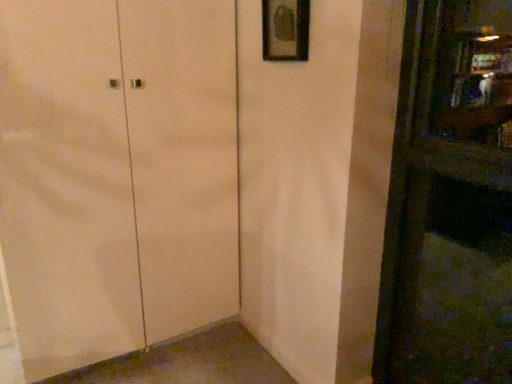
This screenshot has width=512, height=384. What do you see at coordinates (116, 173) in the screenshot? I see `matte white cabinet at center` at bounding box center [116, 173].

This screenshot has height=384, width=512. What are the coordinates of `matte white cabinet at center` in the screenshot? It's located at (116, 173).

The width and height of the screenshot is (512, 384). What are the coordinates of `matte black picture frame at upper center` in the screenshot? It's located at (285, 30).

This screenshot has height=384, width=512. What do you see at coordinates (285, 30) in the screenshot?
I see `matte black picture frame at upper center` at bounding box center [285, 30].

You are a GUI agent. You are given a task and a screenshot of the screen. Output one action in this format:
    pyautogui.click(x=<x>, y=<y>)
    Task: Click on the matte white cabinet at center
    The image size is (512, 384).
    Given the screenshot: What is the action you would take?
    pyautogui.click(x=116, y=173)

Is matte black picture frame at upper center to the left of matte white cabinet at center from the viewer's perspective?

Incorrect, matte black picture frame at upper center is not on the left side of matte white cabinet at center.

Between matte black picture frame at upper center and matte white cabinet at center, which one is positioned behind?

Positioned behind is matte black picture frame at upper center.

Does point (267, 40) come in front of point (116, 79)?

No, it is not.

From the image's perspective, is matte black picture frame at upper center located above or below matte white cabinet at center?

matte black picture frame at upper center is above matte white cabinet at center.

From a real-world perspective, relative to matte white cabinet at center, is matte black picture frame at upper center vertically above or below?

From a real-world perspective, matte black picture frame at upper center is physically above matte white cabinet at center.

Consider the image. Which object is thinner, matte black picture frame at upper center or matte white cabinet at center?

With smaller width is matte black picture frame at upper center.

Can you confirm if matte black picture frame at upper center is shorter than matte white cabinet at center?

Yes, matte black picture frame at upper center is shorter than matte white cabinet at center.

Considering the sizes of objects matte black picture frame at upper center and matte white cabinet at center in the image provided, who is bigger, matte black picture frame at upper center or matte white cabinet at center?

matte white cabinet at center is bigger.

Based on the photo, does matte black picture frame at upper center contain matte white cabinet at center?

Definitely not — matte white cabinet at center is not inside matte black picture frame at upper center.

Is matte black picture frame at upper center next to matte white cabinet at center?

matte black picture frame at upper center and matte white cabinet at center are not in contact.

Is matte black picture frame at upper center aimed at matte white cabinet at center?

No, matte black picture frame at upper center is not aimed at matte white cabinet at center.

How different are the orientations of matte black picture frame at upper center and matte white cabinet at center in degrees?

90 degrees.

Image resolution: width=512 pixels, height=384 pixels. In order to click on door in front of the matte black picture frame at upper center in this screenshot , I will do `click(116, 173)`.

Considering the positions of objects matte white cabinet at center and matte black picture frame at upper center in the image provided, who is more to the right, matte white cabinet at center or matte black picture frame at upper center?

matte black picture frame at upper center is more to the right.

Is the depth of matte white cabinet at center greater than that of matte black picture frame at upper center?

No, it is in front of matte black picture frame at upper center.

Does point (109, 119) come behind point (295, 39)?

Yes, point (109, 119) is farther from viewer.

From the image's perspective, who appears lower, matte white cabinet at center or matte black picture frame at upper center?

matte white cabinet at center.

From a real-world perspective, which object rests below the other?

matte white cabinet at center is physically lower.

Between matte white cabinet at center and matte black picture frame at upper center, which one has larger width?

matte white cabinet at center is wider.

Is matte white cabinet at center shorter than matte black picture frame at upper center?

Incorrect, the height of matte white cabinet at center does not fall short of that of matte black picture frame at upper center.

Between matte white cabinet at center and matte black picture frame at upper center, which one has larger size?

matte white cabinet at center is bigger.

Would you say matte white cabinet at center contains matte black picture frame at upper center?

That's incorrect, matte black picture frame at upper center is not inside matte white cabinet at center.

Would you consider matte white cabinet at center to be distant from matte black picture frame at upper center?

Actually, matte white cabinet at center and matte black picture frame at upper center are a little close together.

Is matte white cabinet at center facing away from matte black picture frame at upper center?

No, matte white cabinet at center is not facing away from matte black picture frame at upper center.

What's the angular difference between matte white cabinet at center and matte black picture frame at upper center's facing directions?

matte white cabinet at center and matte black picture frame at upper center are facing 90 degrees away from each other.

The image size is (512, 384). Identify the location of picture frame located above the matte white cabinet at center (from the image's perspective). (285, 30).

The width and height of the screenshot is (512, 384). What are the coordinates of `door located below the matte black picture frame at upper center (from the image's perspective)` in the screenshot? It's located at [116, 173].

At what (x,y) coordinates should I click in order to perform the action: click on picture frame above the matte white cabinet at center (from the image's perspective). Please return your answer as a coordinate pair (x, y). This screenshot has height=384, width=512. Looking at the image, I should click on (285, 30).